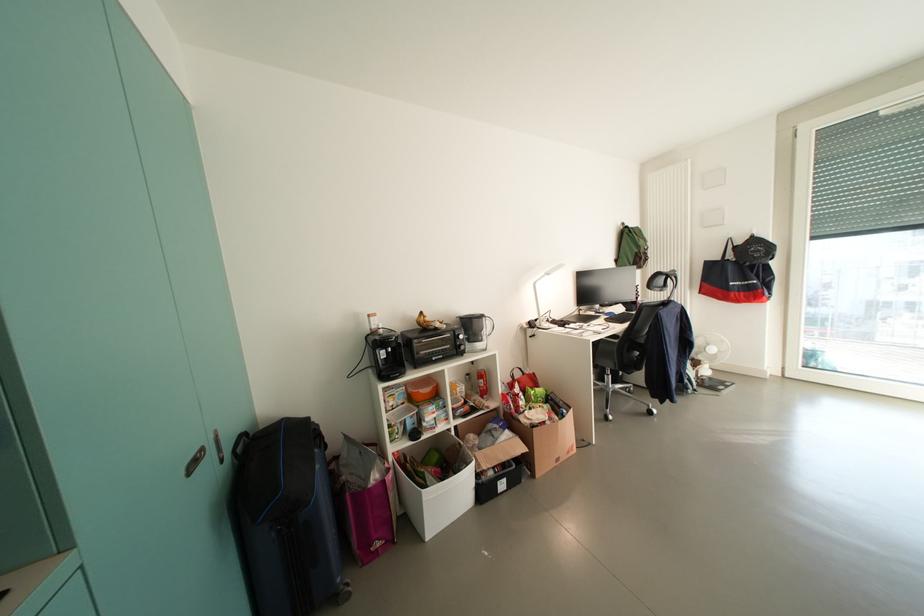
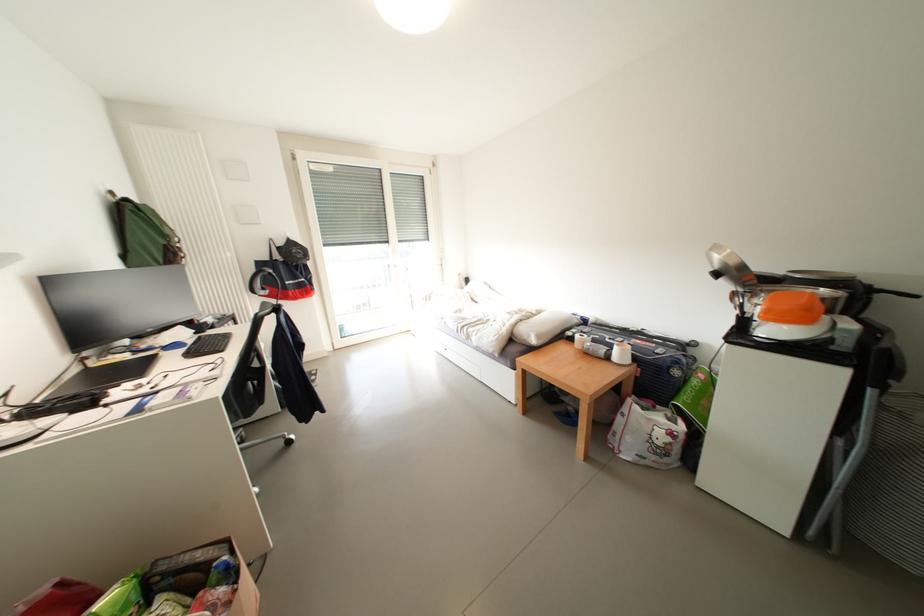
Where in the second image is the point corresponding to the point at 624,264 from the first image?

(131, 259)